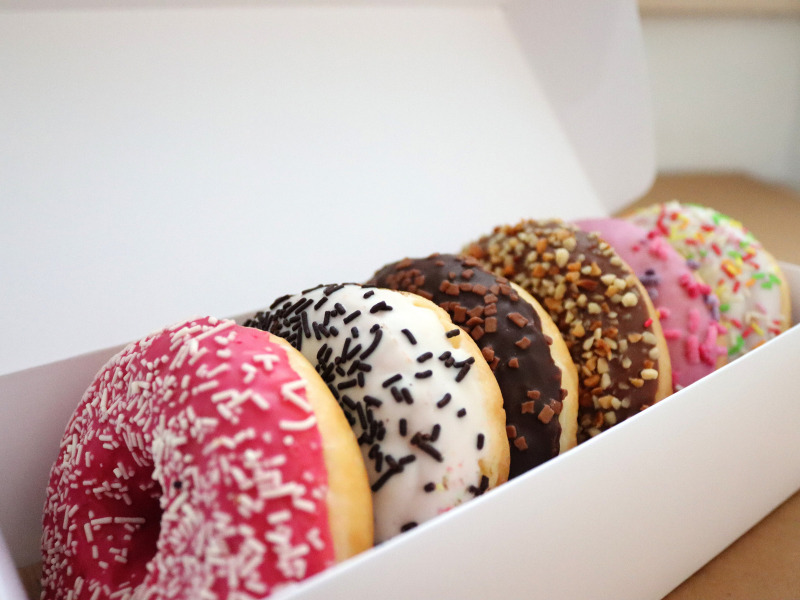
Identify the location of table. (758, 569), (740, 203).